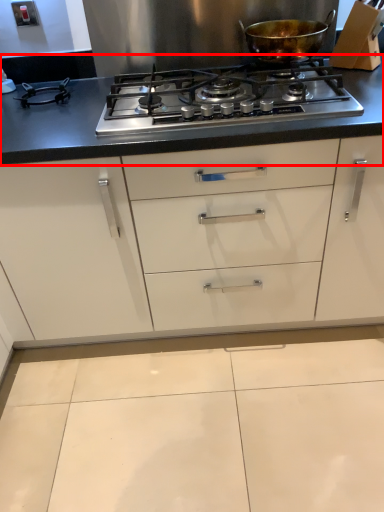
Question: In this image, where is countertop (annotated by the red box) located relative to kitchen appliance?

Choices:
 (A) right
 (B) left

Answer: (B)